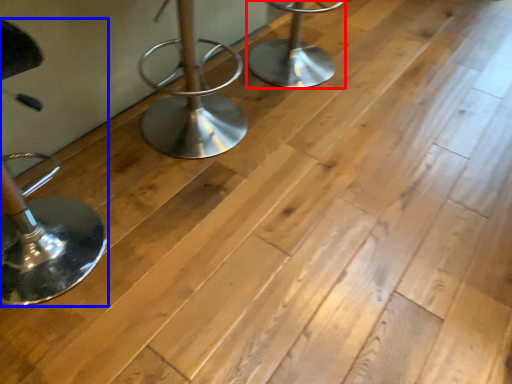
Question: Among these objects, which one is nearest to the camera, furniture (highlighted by a red box) or furniture (highlighted by a blue box)?

Choices:
 (A) furniture
 (B) furniture

Answer: (B)